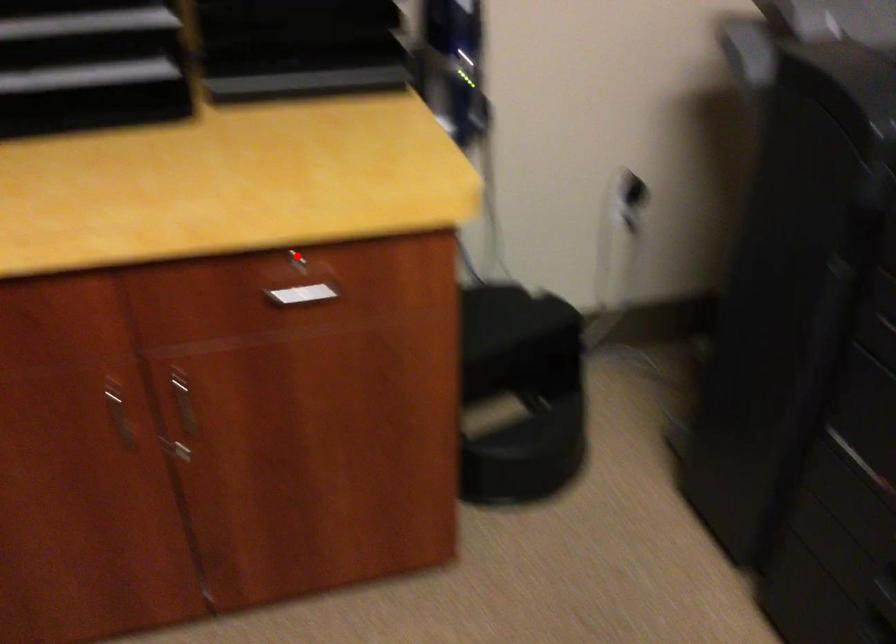
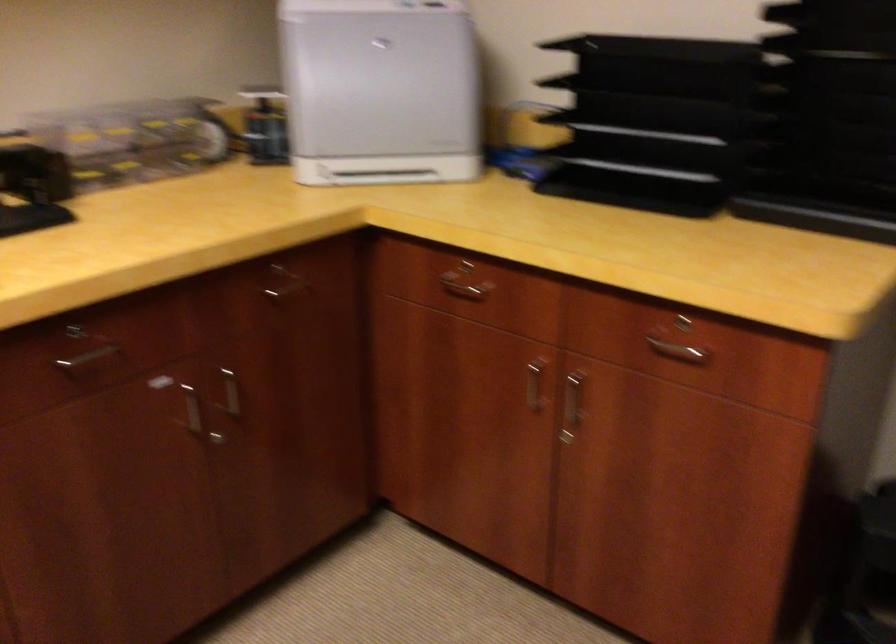
Question: I am providing you with two images of the same scene from different viewpoints. In image1, a red point is highlighted. Considering the same 3D point in image2, which of the following is correct?

Choices:
 (A) It is closer
 (B) It is farther

Answer: (B)